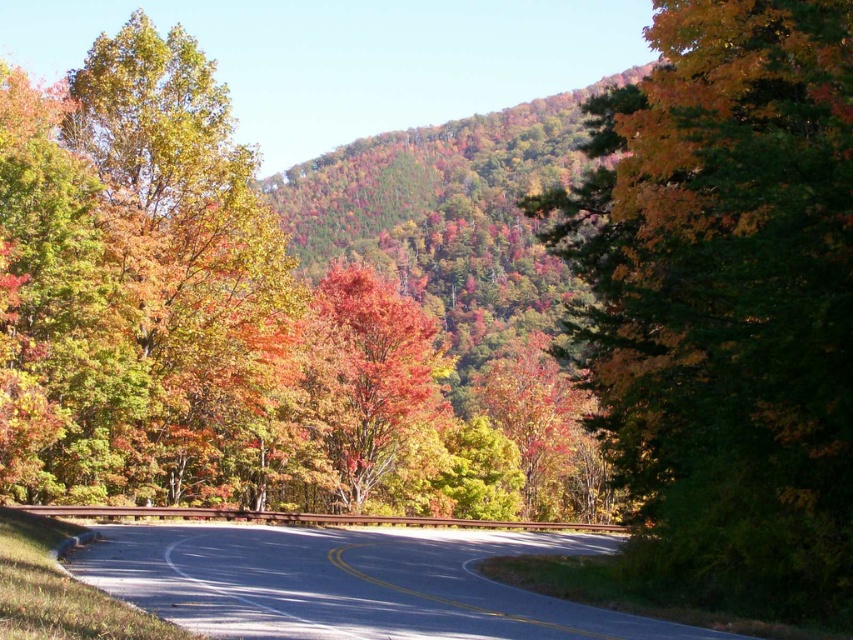
You are a photographer positioned at the start of the road. You want to take a photo that includes both the point at (x=549, y=208) and the point at (x=645, y=634). Which point will appear closer to the camera in the photo?

The point at (x=645, y=634) will appear closer to the camera in the photo because it is physically closer to the photographer than the point at (x=549, y=208), which is further away.

You are a GPS device trying to navigate a car along the scenic road through the autumn forest. The car is currently at the starting point. According to the image, where should the car head next to stay on the asphalt road at center?

The asphalt road at center is located at point (350, 582), so the car should head towards that coordinate to stay on the asphalt road at center.